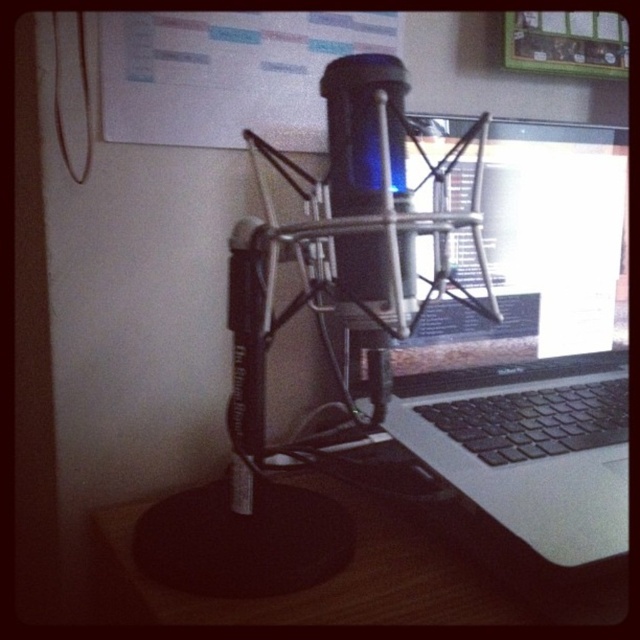
Can you confirm if wooden table at center is positioned to the left of whiteboard at upper center?

Incorrect, wooden table at center is not on the left side of whiteboard at upper center.

Is wooden table at center positioned behind whiteboard at upper center?

No, wooden table at center is closer to the viewer.

Is point (380, 556) farther from viewer compared to point (202, 131)?

No.

This screenshot has width=640, height=640. What are the coordinates of `wooden table at center` in the screenshot? It's located at (380, 572).

Does point (522, 241) come farther from viewer compared to point (378, 282)?

Yes, it is.

Is point (518, 212) less distant than point (378, 76)?

No, it is behind (378, 76).

This screenshot has height=640, width=640. Identify the location of sleek silver laptop at center. (532, 349).

Is sleek silver laptop at center above whiteboard at upper center?

No, sleek silver laptop at center is not above whiteboard at upper center.

Does point (529, 518) come farther from viewer compared to point (102, 88)?

No.

Where is `sleek silver laptop at center`? The width and height of the screenshot is (640, 640). sleek silver laptop at center is located at coordinates (532, 349).